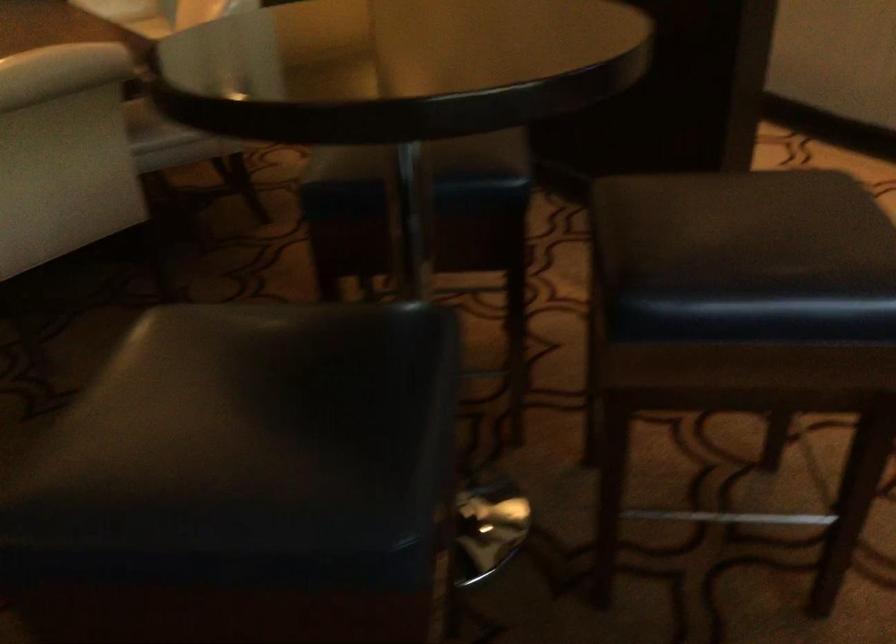
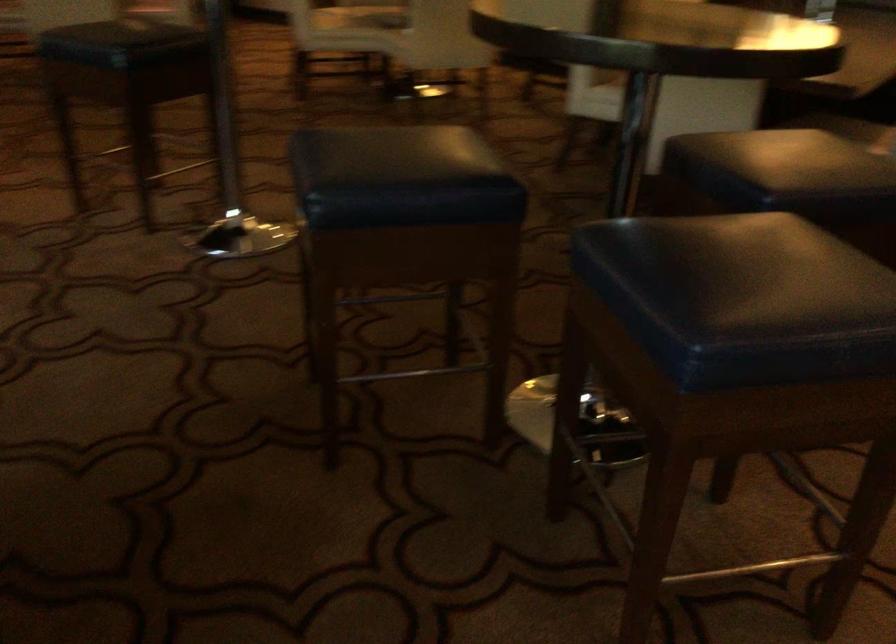
In the second image, find the point that corresponds to (405,380) in the first image.

(401, 178)